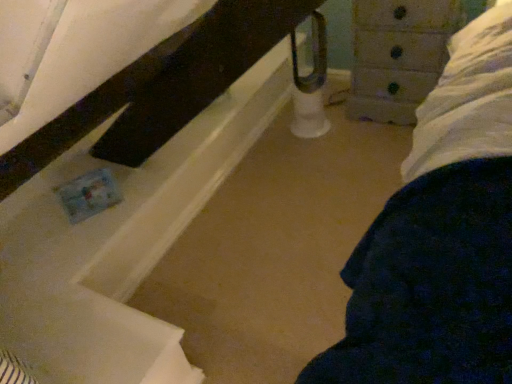
Question: Should I look upward or downward to see wooden chest of drawers at upper right?

Choices:
 (A) up
 (B) down

Answer: (A)